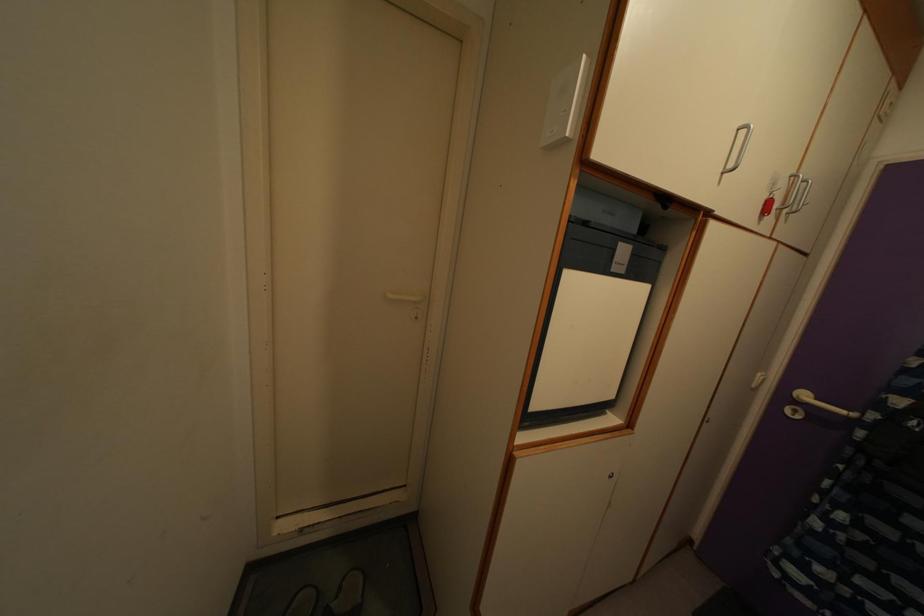
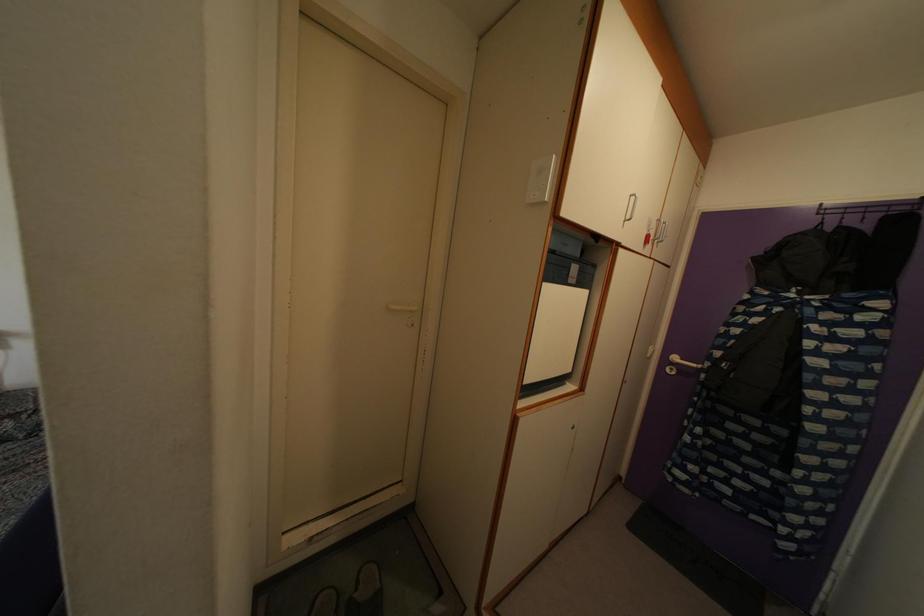
Question: Based on the continuous images, in which direction is the camera rotating? Reply with the corresponding letter.

Choices:
 (A) Left
 (B) Right
 (C) Up
 (D) Down

Answer: (B)